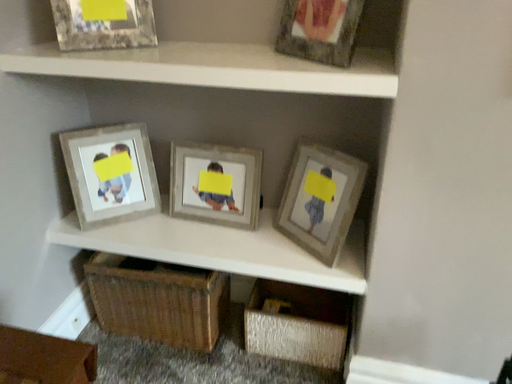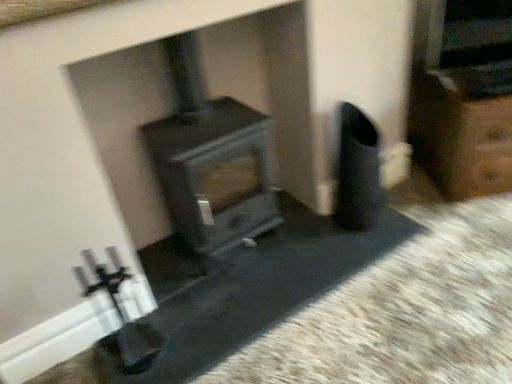
Question: How did the camera likely rotate when shooting the video?

Choices:
 (A) rotated left
 (B) rotated right

Answer: (B)